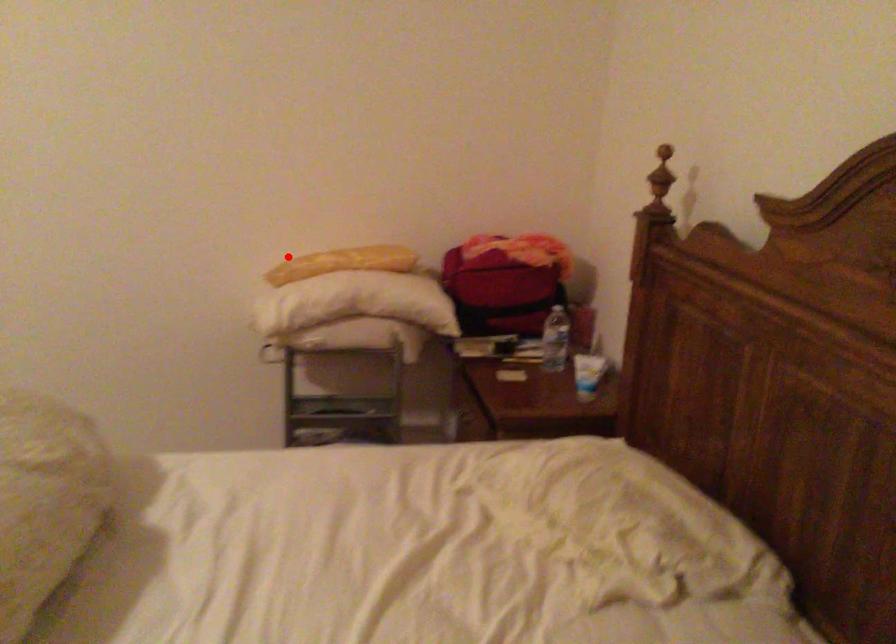
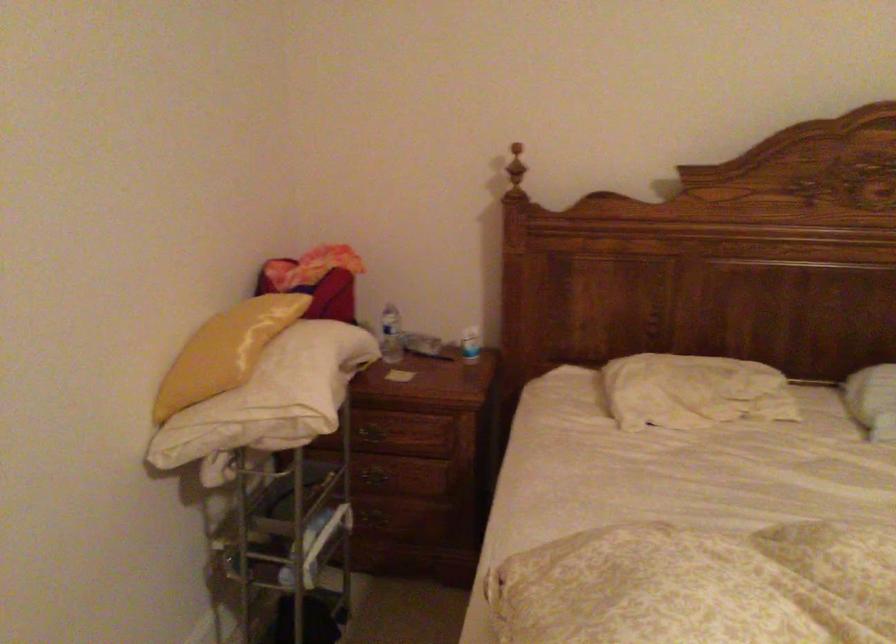
Locate, in the second image, the point that corresponds to the highlighted location in the first image.

(225, 351)